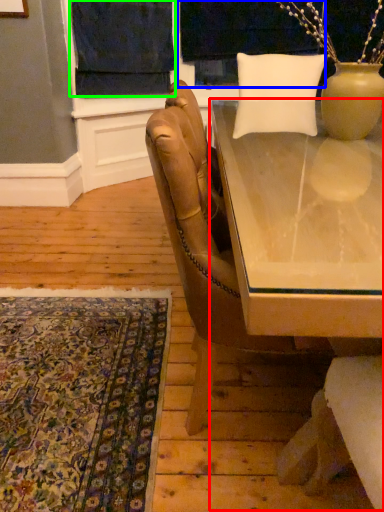
Question: Which is farther away from table (highlighted by a red box)? window screen (highlighted by a blue box) or curtain (highlighted by a green box)?

Choices:
 (A) window screen
 (B) curtain

Answer: (A)